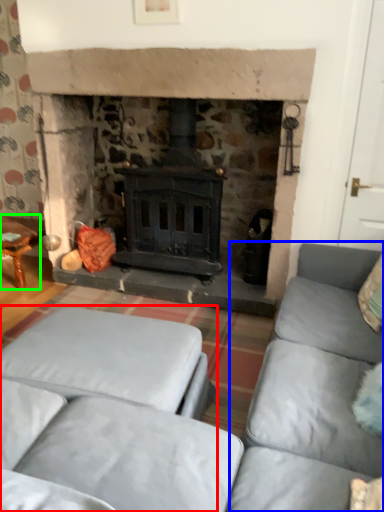
Question: Considering the real-world distances, which object is farthest from studio couch (highlighted by a red box)? couch (highlighted by a blue box) or table (highlighted by a green box)?

Choices:
 (A) couch
 (B) table

Answer: (B)